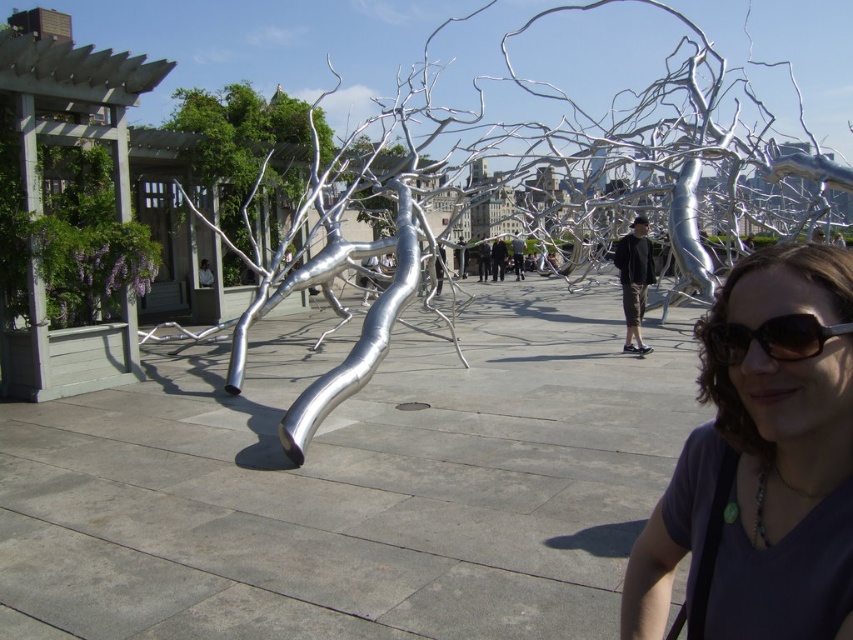
Question: Which point is farther to the camera?

Choices:
 (A) black reflective sunglasses at lower right
 (B) brushed metal tree at upper left
 (C) silver metallic sculpture at center
 (D) matte black shirt at lower right

Answer: (B)

Question: Is brushed metal tree at upper left bigger than black reflective sunglasses at lower right?

Choices:
 (A) yes
 (B) no

Answer: (A)

Question: Among these points, which one is farthest from the camera?

Choices:
 (A) (439, 138)
 (B) (756, 336)

Answer: (A)

Question: Does brushed metal tree at upper left have a smaller size compared to black reflective sunglasses at lower right?

Choices:
 (A) yes
 (B) no

Answer: (B)

Question: Is silver metallic sculpture at center above black reflective sunglasses at lower right?

Choices:
 (A) yes
 (B) no

Answer: (A)

Question: Which object appears closest to the camera in this image?

Choices:
 (A) silver metallic sculpture at center
 (B) matte black shirt at lower right
 (C) black reflective sunglasses at lower right
 (D) brushed metal tree at upper left

Answer: (B)